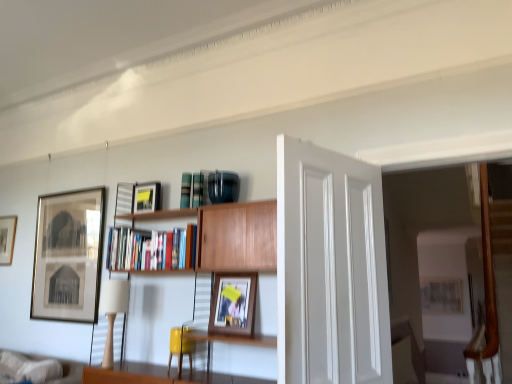
Question: Is matte black picture frame at left, which appears as the 4th picture frame when viewed from the right, wider or thinner than white smooth door at center?

Choices:
 (A) thin
 (B) wide

Answer: (A)

Question: Is point pos(10,246) positioned closer to the camera than point pos(351,240)?

Choices:
 (A) closer
 (B) farther

Answer: (B)

Question: Estimate the real-world distances between objects in this image. Which object is closer to the matte yellow swivel chair at center?

Choices:
 (A) wooden bookshelf at center
 (B) wooden bookcase at center
 (C) matte black picture frame at left, arranged as the 4th picture frame when viewed from the front
 (D) white smooth door at center
 (E) wooden framed photo at center, the 1th picture frame from the front

Answer: (E)

Question: Considering the real-world distances, which object is closest to the wooden bookcase at center?

Choices:
 (A) matte yellow swivel chair at center
 (B) white smooth door at center
 (C) wooden framed photo at center, the 4th picture frame in the left-to-right sequence
 (D) wooden bookshelf at center
 (E) beige fabric lampshade at left

Answer: (D)